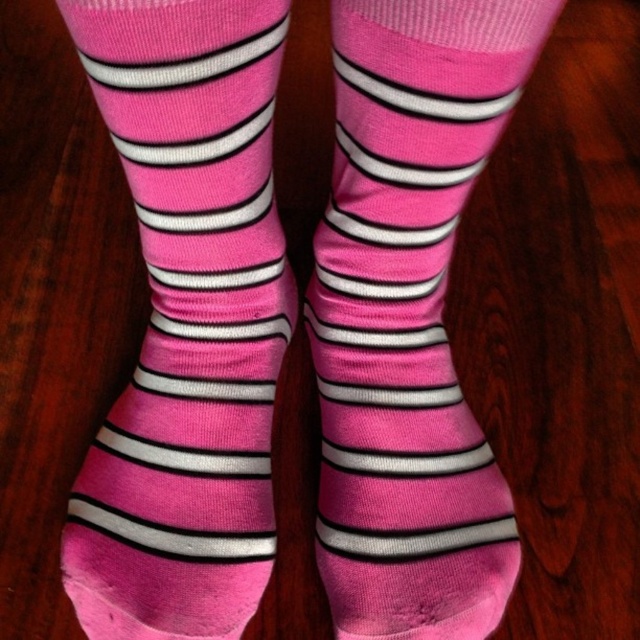
Who is more forward, (280, 269) or (340, 598)?

Positioned in front is point (340, 598).

Who is more distant from viewer, (220, 513) or (337, 330)?

Point (337, 330)

Locate an element on the screen. Image resolution: width=640 pixels, height=640 pixels. pink soft cotton sock at center is located at coordinates (186, 321).